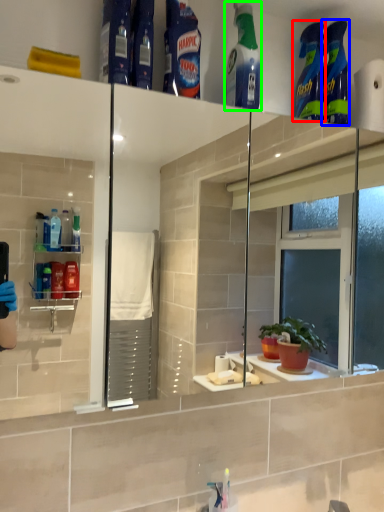
Question: Estimate the real-world distances between objects in this image. Which object is closer to cleaning product (highlighted by a red box), cleaning product (highlighted by a blue box) or cleaning product (highlighted by a green box)?

Choices:
 (A) cleaning product
 (B) cleaning product

Answer: (A)